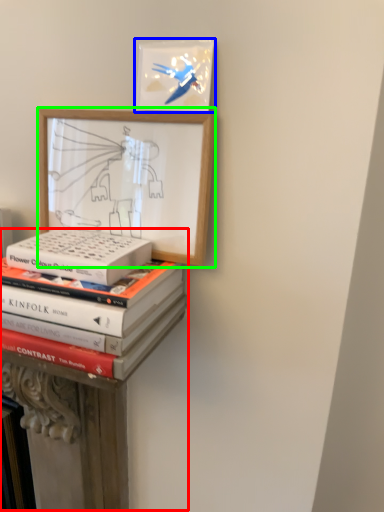
Question: Estimate the real-world distances between objects in this image. Which object is closer to bookshelf (highlighted by a red box), picture frame (highlighted by a blue box) or picture frame (highlighted by a green box)?

Choices:
 (A) picture frame
 (B) picture frame

Answer: (B)